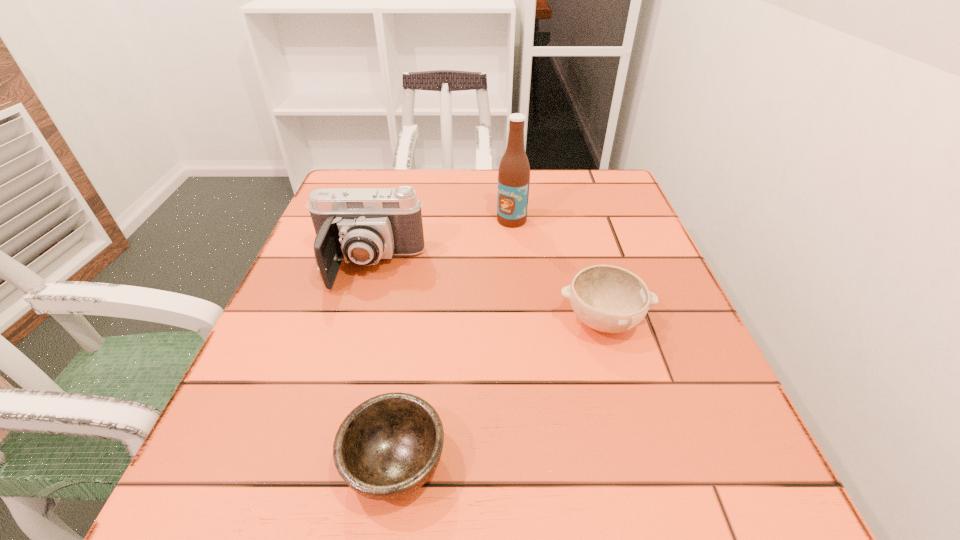
At what (x,y) coordinates should I click in order to perform the action: click on blank region between the tallest object and the third nearest object. Please return your answer as a coordinate pair (x, y). The width and height of the screenshot is (960, 540). Looking at the image, I should click on (441, 243).

What are the coordinates of `free space between the right bowl and the farthest object` in the screenshot? It's located at (558, 271).

The image size is (960, 540). In order to click on free spot between the third nearest object and the nearest object in this screenshot , I will do `click(382, 365)`.

At what (x,y) coordinates should I click in order to perform the action: click on vacant space that's between the second tallest object and the second object from right to left. Please return your answer as a coordinate pair (x, y). This screenshot has width=960, height=540. Looking at the image, I should click on (441, 243).

Where is `the third closest object to the farthest object`? The height and width of the screenshot is (540, 960). the third closest object to the farthest object is located at coordinates (386, 448).

Select which object is the closest to the nearer bowl. Please provide its 2D coordinates. Your answer should be formatted as a tuple, i.e. [(x, y)], where the tuple contains the x and y coordinates of a point satisfying the conditions above.

[(610, 299)]

Locate an element on the screen. This screenshot has height=540, width=960. free spot that satisfies the following two spatial constraints: 1. at the front of the camera with an open lens cover; 2. on the left side of the shorter bowl is located at coordinates (311, 463).

Where is `vacant space that satisfies the following two spatial constraints: 1. at the front of the farther bowl with an open lens cover; 2. on the right side of the camera`? This screenshot has height=540, width=960. vacant space that satisfies the following two spatial constraints: 1. at the front of the farther bowl with an open lens cover; 2. on the right side of the camera is located at coordinates (352, 321).

Locate an element on the screen. This screenshot has width=960, height=540. free space that satisfies the following two spatial constraints: 1. at the front of the camera with an open lens cover; 2. on the left side of the nearer bowl is located at coordinates (311, 463).

The image size is (960, 540). Find the location of `blank area in the image that satisfies the following two spatial constraints: 1. at the front of the second farthest object with an open lens cover; 2. on the left side of the rightmost object`. blank area in the image that satisfies the following two spatial constraints: 1. at the front of the second farthest object with an open lens cover; 2. on the left side of the rightmost object is located at coordinates (352, 321).